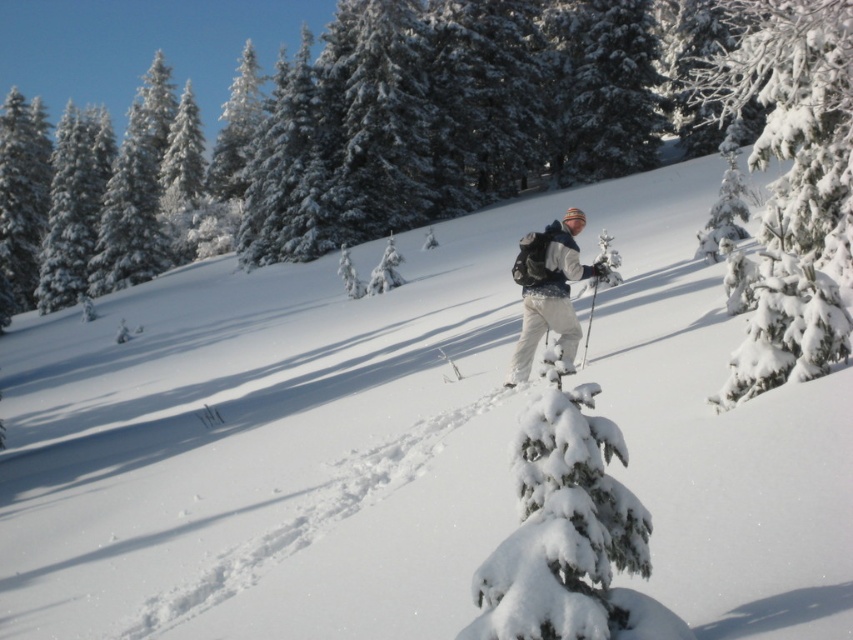
Question: Does white snow-covered tree at center come in front of white matte ski pants at center?

Choices:
 (A) no
 (B) yes

Answer: (B)

Question: Among these points, which one is nearest to the camera?

Choices:
 (A) (566, 355)
 (B) (837, 355)

Answer: (B)

Question: Among these objects, which one is farthest from the camera?

Choices:
 (A) white matte ski pants at center
 (B) white snow-covered tree at center

Answer: (A)

Question: Can you confirm if white snow-covered tree at center is positioned to the left of white matte ski pants at center?

Choices:
 (A) yes
 (B) no

Answer: (B)

Question: Is white snow-covered tree at center to the right of white matte ski pants at center from the viewer's perspective?

Choices:
 (A) no
 (B) yes

Answer: (B)